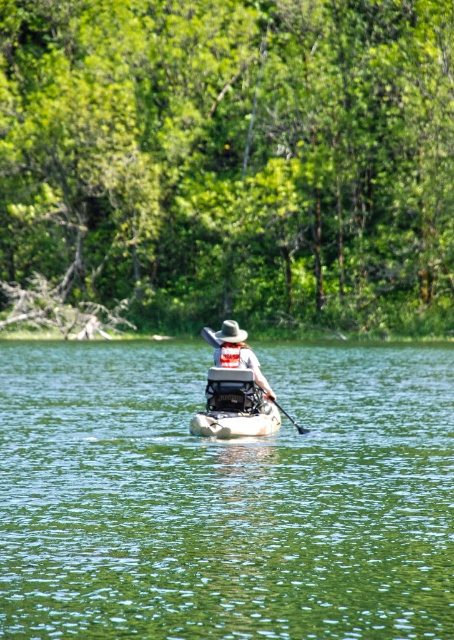
Question: Is green leafy trees at upper center behind white plastic canoe at center?

Choices:
 (A) no
 (B) yes

Answer: (B)

Question: Which object is farther from the camera taking this photo?

Choices:
 (A) matte khaki hat at center
 (B) white fabric life jacket at center

Answer: (B)

Question: Considering the relative positions of matte khaki hat at center and white fabric life jacket at center in the image provided, where is matte khaki hat at center located with respect to white fabric life jacket at center?

Choices:
 (A) below
 (B) above

Answer: (B)

Question: Which of the following is the farthest from the observer?

Choices:
 (A) white fabric life jacket at center
 (B) green leafy trees at upper center
 (C) white plastic canoe at center
 (D) matte khaki hat at center

Answer: (B)

Question: Which point is farther from the camera taking this photo?

Choices:
 (A) (230, 381)
 (B) (198, 424)
 (C) (169, 417)

Answer: (C)

Question: Is green leafy trees at upper center positioned before wooden paddle at center?

Choices:
 (A) no
 (B) yes

Answer: (A)